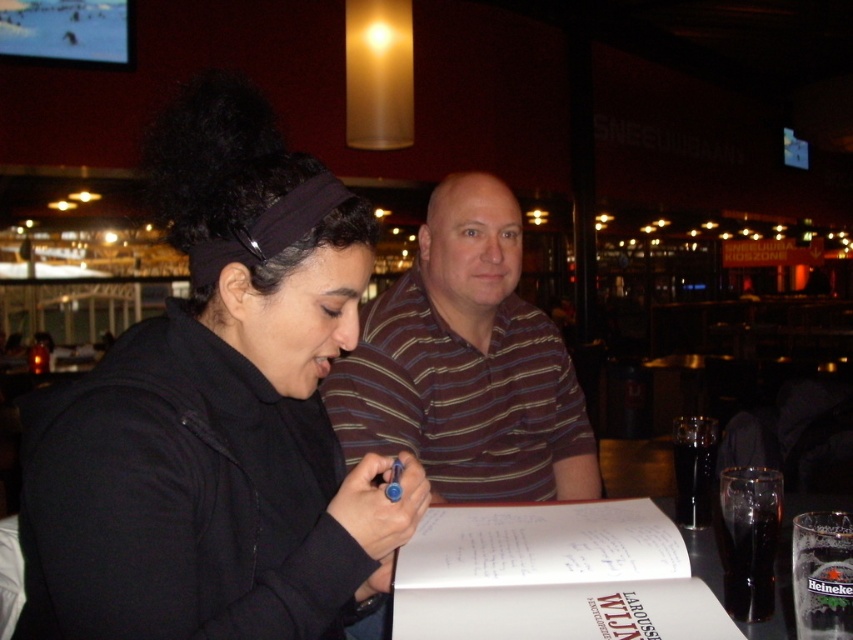
Question: Among these points, which one is farthest from the camera?

Choices:
 (A) (196, 577)
 (B) (677, 632)

Answer: (A)

Question: Among these objects, which one is nearest to the camera?

Choices:
 (A) black matte jacket at center
 (B) translucent glass table at center
 (C) white paper at center

Answer: (A)

Question: Can you confirm if striped cotton shirt at center is positioned below translucent glass table at center?

Choices:
 (A) no
 (B) yes

Answer: (A)

Question: From the image, what is the correct spatial relationship of black matte jacket at center in relation to striped cotton shirt at center?

Choices:
 (A) left
 (B) right

Answer: (A)

Question: Which of these objects is positioned farthest from the black matte jacket at center?

Choices:
 (A) white paper at center
 (B) striped cotton shirt at center
 (C) translucent glass table at center

Answer: (B)

Question: Is black matte jacket at center to the left of white paper at center from the viewer's perspective?

Choices:
 (A) no
 (B) yes

Answer: (B)